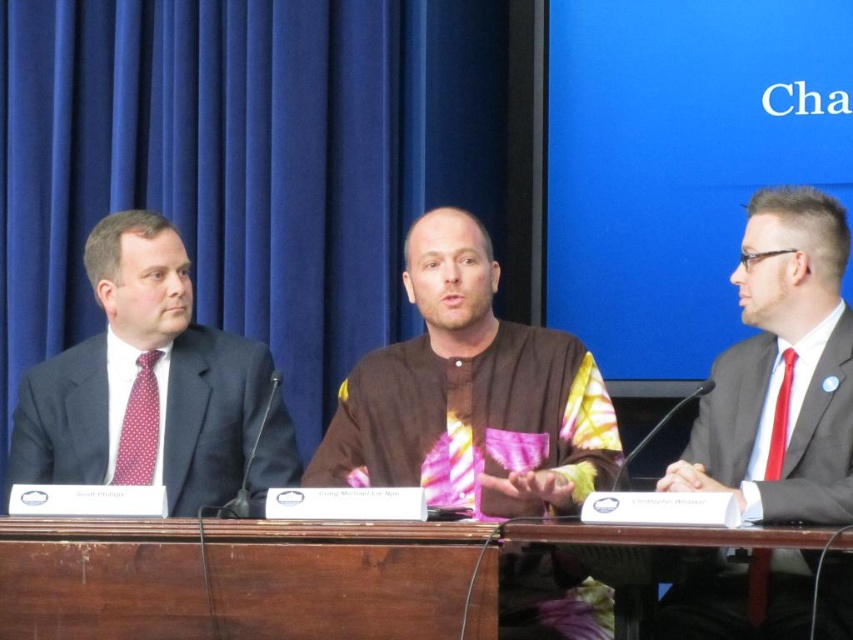
Question: Among these points, which one is nearest to the camera?

Choices:
 (A) (125, 477)
 (B) (115, 550)

Answer: (B)

Question: Which point is closer to the camera?

Choices:
 (A) (224, 340)
 (B) (151, 371)
 (C) (334, 632)

Answer: (C)

Question: Can you confirm if dark gray suit at left is bigger than wooden at center?

Choices:
 (A) no
 (B) yes

Answer: (B)

Question: Considering the relative positions of brown textured shirt at center and red silk tie at right in the image provided, where is brown textured shirt at center located with respect to red silk tie at right?

Choices:
 (A) right
 (B) left

Answer: (B)

Question: Which object is farther from the camera taking this photo?

Choices:
 (A) wooden at center
 (B) red silk tie at right
 (C) brown textured shirt at center
 (D) dark gray suit at left

Answer: (B)

Question: In this image, where is polka dot silk tie at left located relative to red silk tie at right?

Choices:
 (A) above
 (B) below

Answer: (B)